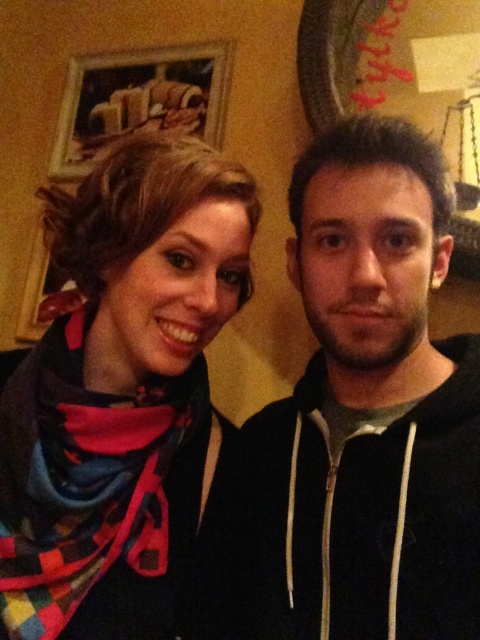
Question: Is multicolored woven scarf at left thinner than wooden frame at upper left?

Choices:
 (A) yes
 (B) no

Answer: (A)

Question: Which of the following is the closest to the observer?

Choices:
 (A) wooden frame at upper left
 (B) multicolored woven scarf at left

Answer: (B)

Question: Which of the following is the farthest from the observer?

Choices:
 (A) (60, 360)
 (B) (108, 54)

Answer: (B)

Question: Does multicolored woven scarf at left appear on the left side of wooden frame at upper left?

Choices:
 (A) no
 (B) yes

Answer: (A)

Question: Is multicolored woven scarf at left closer to camera compared to wooden frame at upper left?

Choices:
 (A) no
 (B) yes

Answer: (B)